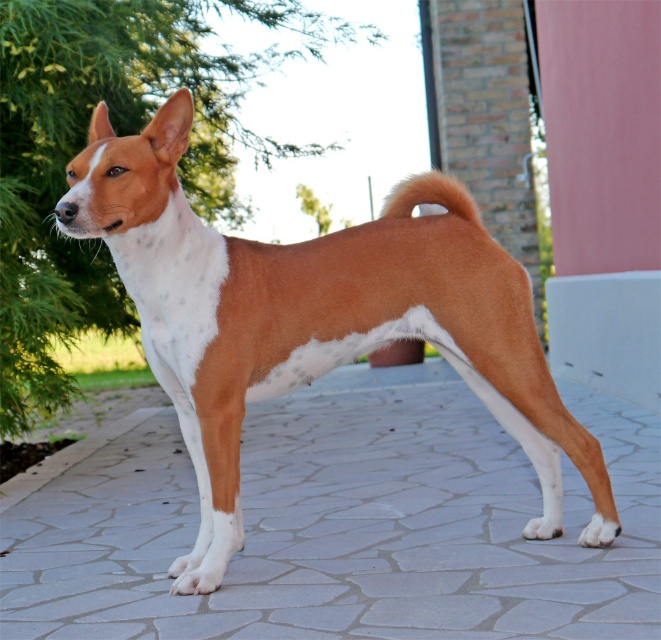
In the scene shown: Does gray stone pavement at center appear on the right side of brown furry tail at upper right?

In fact, gray stone pavement at center is to the left of brown furry tail at upper right.

Is gray stone pavement at center shorter than brown furry tail at upper right?

Yes.

Between point (369, 608) and point (451, 189), which one is positioned behind?

The point (451, 189) is more distant.

Locate an element on the screen. gray stone pavement at center is located at coordinates (344, 524).

Measure the distance between gray stone pavement at center and camera.

A distance of 21.04 feet exists between gray stone pavement at center and camera.

The width and height of the screenshot is (661, 640). In order to click on gray stone pavement at center in this screenshot , I will do `click(344, 524)`.

The image size is (661, 640). What are the coordinates of `brown/white fur dog at center` in the screenshot? It's located at (309, 323).

Can you confirm if brown/white fur dog at center is shorter than brown furry tail at upper right?

In fact, brown/white fur dog at center may be taller than brown furry tail at upper right.

Does point (134, 204) come in front of point (389, 196)?

Yes, point (134, 204) is closer to viewer.

Locate an element on the screen. The height and width of the screenshot is (640, 661). brown/white fur dog at center is located at coordinates (309, 323).